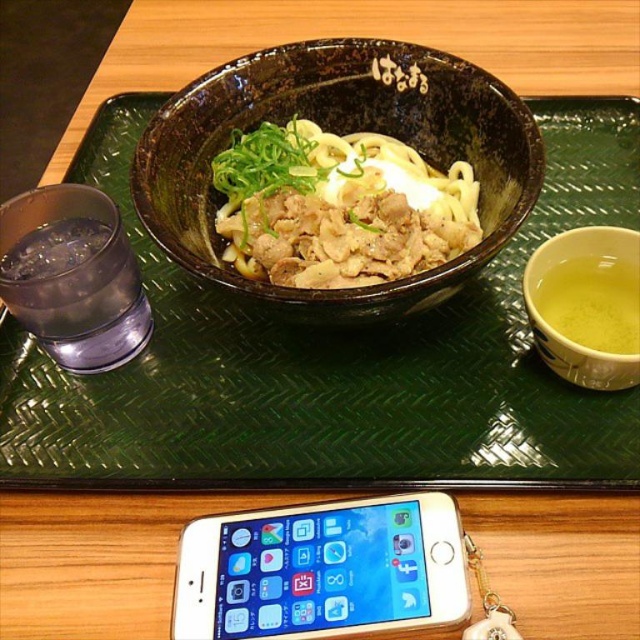
Question: Does green textured tray at center appear over shiny brown bowl at center?

Choices:
 (A) yes
 (B) no

Answer: (B)

Question: Based on their relative distances, which object is farther from the gold metallic smartphone at lower center?

Choices:
 (A) shiny brown bowl at center
 (B) black glazed bowl at center
 (C) green textured tray at center

Answer: (B)

Question: Is shiny brown bowl at center positioned at the back of green liquid at right?

Choices:
 (A) yes
 (B) no

Answer: (B)

Question: Which of the following is the closest to the observer?

Choices:
 (A) (563, 273)
 (B) (385, 72)
 (C) (369, 541)
 (D) (128, 144)

Answer: (C)

Question: Which of these objects is positioned farthest from the transparent plastic cup at left?

Choices:
 (A) green liquid at right
 (B) shiny brown bowl at center
 (C) green textured tray at center

Answer: (A)

Question: Can you confirm if green textured tray at center is positioned below transparent plastic cup at left?

Choices:
 (A) no
 (B) yes

Answer: (A)